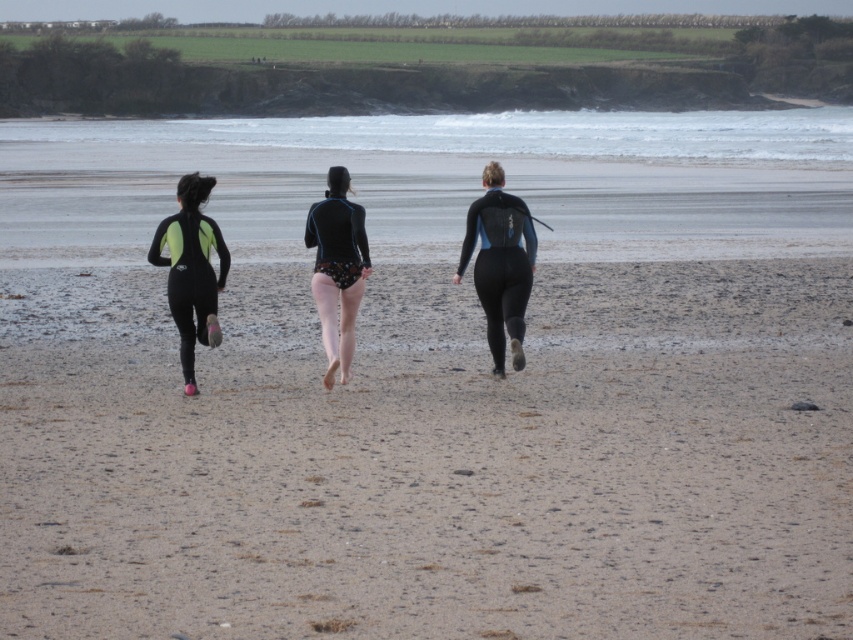
Question: Which of the following is the farthest from the observer?

Choices:
 (A) black matte wetsuit at center
 (B) black matte swimsuit at center
 (C) brown sandy beach at center

Answer: (B)

Question: Which object is farther from the camera taking this photo?

Choices:
 (A) neon green neoprene wetsuit at left
 (B) black matte wetsuit at center
 (C) brown sandy beach at center
 (D) black matte swimsuit at center

Answer: (D)

Question: Which of the following is the closest to the observer?

Choices:
 (A) black matte swimsuit at center
 (B) neon green neoprene wetsuit at left

Answer: (B)

Question: Can you confirm if brown sandy beach at center is positioned to the right of black matte swimsuit at center?

Choices:
 (A) no
 (B) yes

Answer: (A)

Question: Can you confirm if brown sandy beach at center is smaller than neon green neoprene wetsuit at left?

Choices:
 (A) no
 (B) yes

Answer: (A)

Question: Can you confirm if brown sandy beach at center is smaller than neon green neoprene wetsuit at left?

Choices:
 (A) no
 (B) yes

Answer: (A)